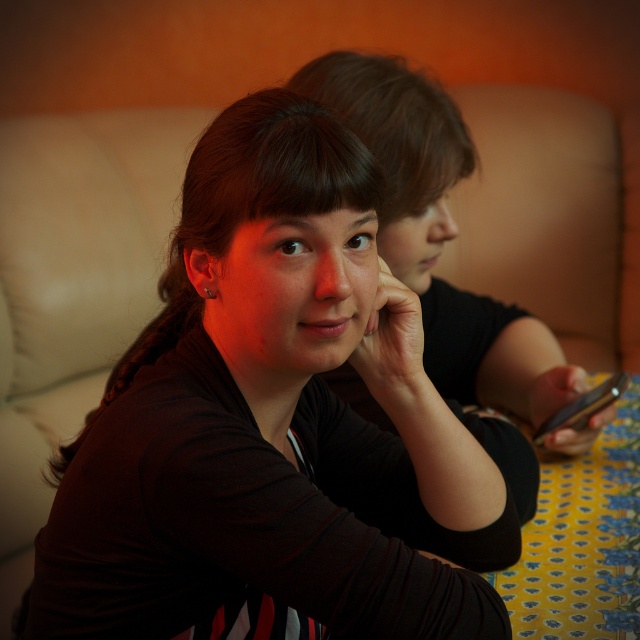
You are standing in the room where the two people are sitting. You want to place a small plant between the two points labeled as point (138, 508) and point (609, 401). Which point should the plant be closer to so it is in front of the other point?

The plant should be placed closer to point (138, 508) because it is in front of point (609, 401).

Looking at this image, you are a photographer adjusting the camera focus. The matte black shirt at center and the black glossy smartphone at right are both in the frame. Which object should you focus on to ensure the other is out of focus?

The matte black shirt at center is positioned over the black glossy smartphone at right. To have the smartphone out of focus while keeping the shirt in focus, adjust the focus on the matte black shirt at center.